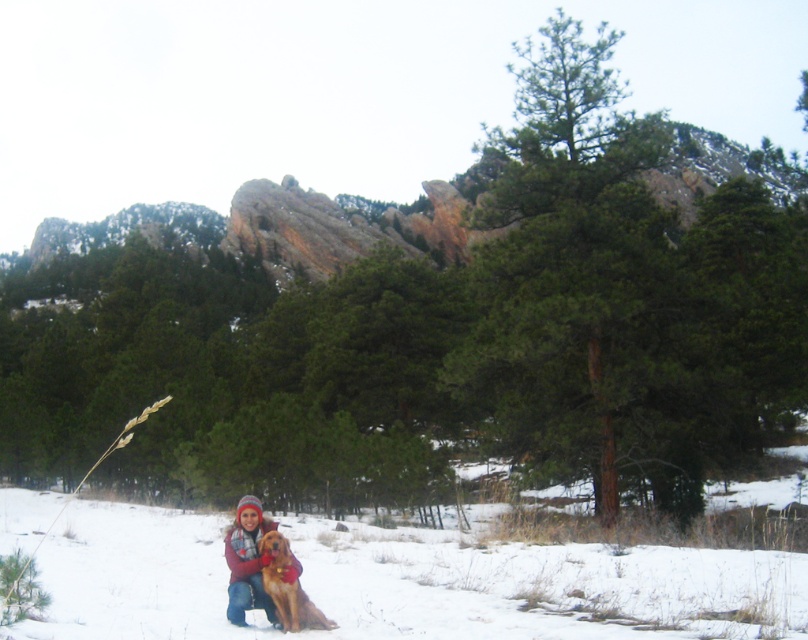
Question: Does golden fur dog at lower center appear over golden fur dog at center?

Choices:
 (A) no
 (B) yes

Answer: (B)

Question: Does white fluffy snow at lower center come behind golden fur dog at center?

Choices:
 (A) no
 (B) yes

Answer: (A)

Question: Which point appears closest to the camera in this image?

Choices:
 (A) (262, 605)
 (B) (268, 540)

Answer: (B)

Question: Which point is closer to the camera?

Choices:
 (A) golden fur dog at center
 (B) white fluffy snow at lower center

Answer: (B)

Question: Is golden fur dog at lower center closer to the viewer compared to golden fur dog at center?

Choices:
 (A) no
 (B) yes

Answer: (A)

Question: Which object is the farthest from the white fluffy snow at lower center?

Choices:
 (A) golden fur dog at lower center
 (B) golden fur dog at center

Answer: (A)